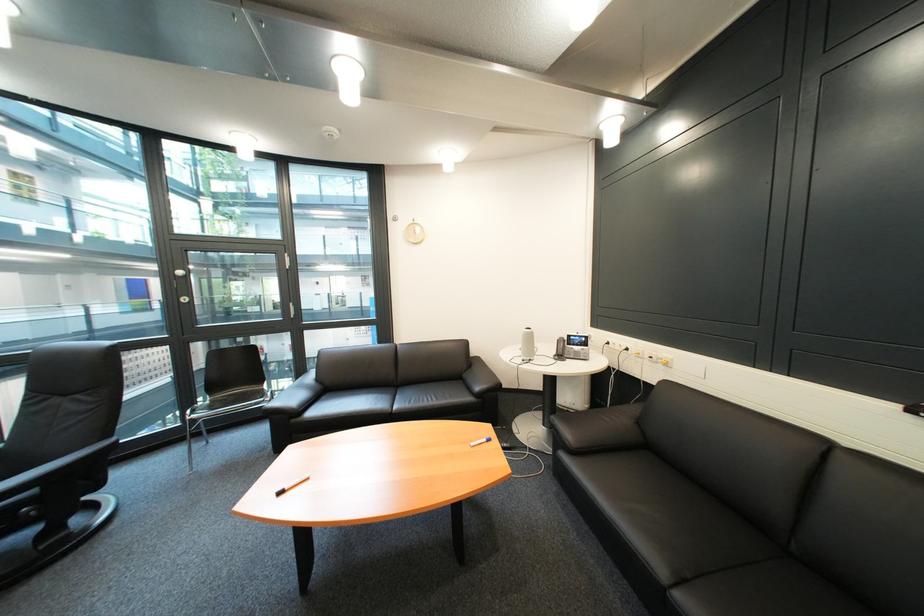
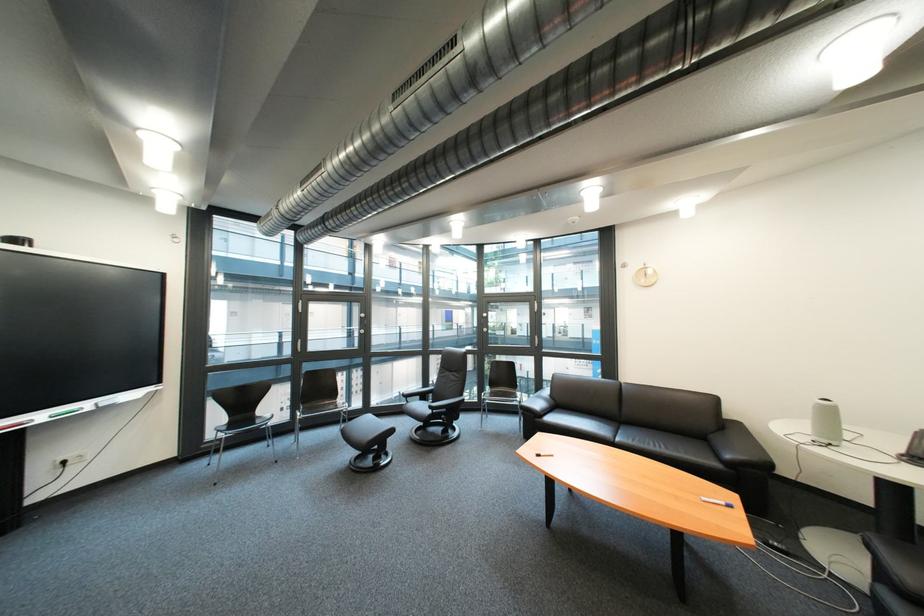
Find the pixel in the second image that matches (x=540, y=334) in the first image.

(833, 406)